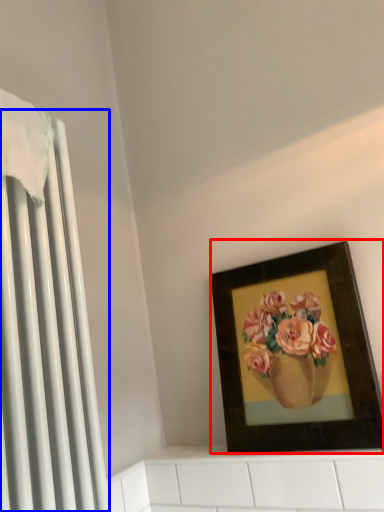
Question: Which object appears closest to the camera in this image, picture frame (highlighted by a red box) or radiator (highlighted by a blue box)?

Choices:
 (A) picture frame
 (B) radiator

Answer: (B)